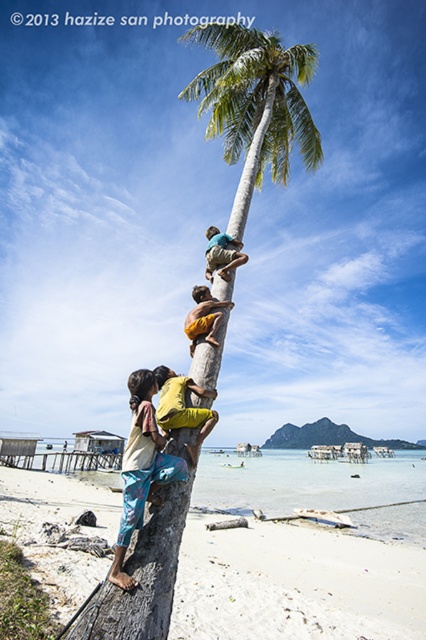
You are a photographer standing at the beach and want to capture a photo of the light brown wooden pole at upper center and the yellow fabric at center. Based on their positions, which object should be placed on the right side of the photo frame?

The light brown wooden pole at upper center should be placed on the right side of the photo frame because the yellow fabric at center is to the left of it.

You are a photographer standing at the base of the palm tree. You want to capture a photo that includes both the white sand beach at lower left and the yellow fabric shirt at center. Which direction should you adjust your camera to ensure both are in the frame?

Since the white sand beach at lower left is below the yellow fabric shirt at center, you should adjust your camera downward to include the white sand beach at lower left while keeping the yellow fabric shirt at center in view.